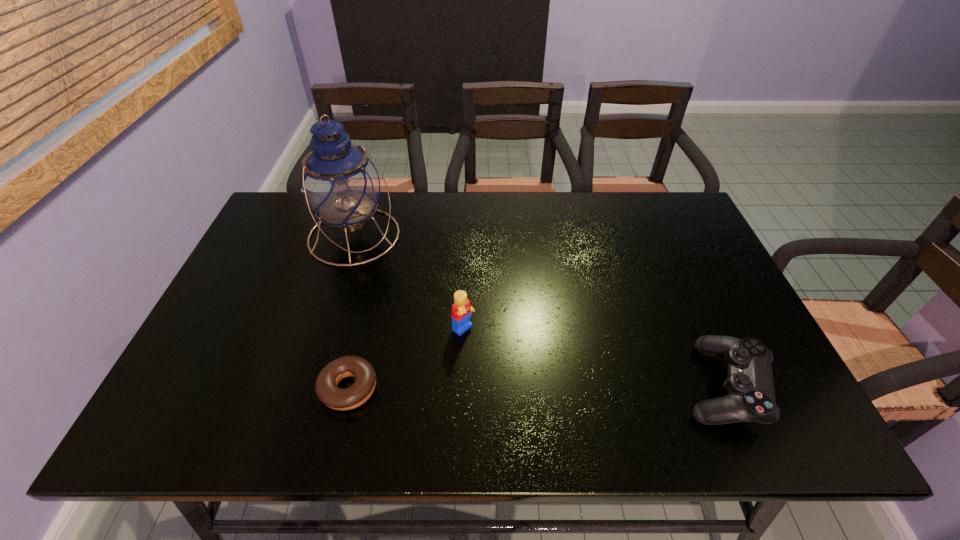
Locate an element on the screen. object that can be found as the closest to the rightmost object is located at coordinates (461, 309).

Find the location of `vacant space that satisfies the following two spatial constraints: 1. on the back side of the shortest object; 2. on the left side of the rightmost object`. vacant space that satisfies the following two spatial constraints: 1. on the back side of the shortest object; 2. on the left side of the rightmost object is located at coordinates (349, 386).